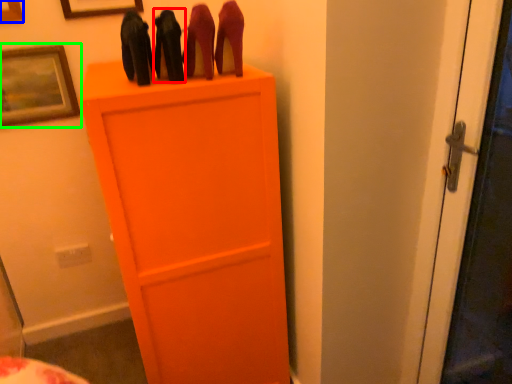
Question: Estimate the real-world distances between objects in this image. Which object is farther from stuff (highlighted by a red box), picture frame (highlighted by a blue box) or picture frame (highlighted by a green box)?

Choices:
 (A) picture frame
 (B) picture frame

Answer: (A)